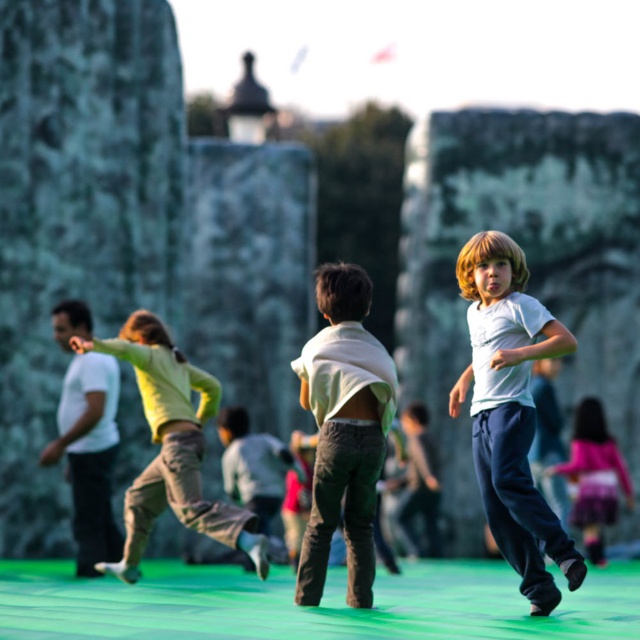
I want to click on light green fabric pants at center, so click(172, 445).

Is point (186, 444) farther from viewer compared to point (96, 545)?

No.

The image size is (640, 640). What do you see at coordinates (172, 445) in the screenshot?
I see `light green fabric pants at center` at bounding box center [172, 445].

Where is `light green fabric pants at center`? light green fabric pants at center is located at coordinates (172, 445).

Does point (362, 548) come closer to viewer compared to point (595, 458)?

That is True.

Where is `matte white shirt at center`? This screenshot has width=640, height=640. matte white shirt at center is located at coordinates (342, 432).

Identify the location of matte white shirt at center. (342, 432).

Measure the distance from white matte shirt at center to pink satin dress at lower right.

18.94 meters

Is point (474, 408) positioned after point (593, 467)?

No, (474, 408) is in front of (593, 467).

What do you see at coordinates (509, 412) in the screenshot? This screenshot has width=640, height=640. I see `white matte shirt at center` at bounding box center [509, 412].

Locate an element on the screen. white matte shirt at center is located at coordinates (509, 412).